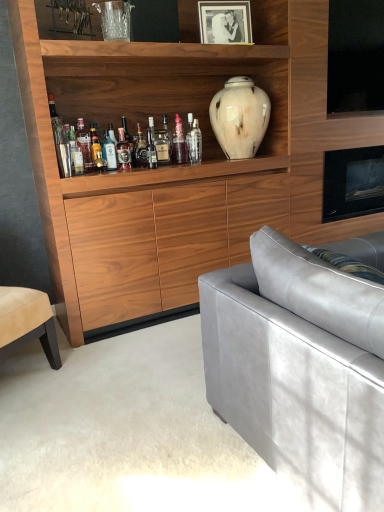
Question: From the image's perspective, does translucent glass bottle at center, placed as the 3th bottle when sorted from right to left, appear higher than clear glass bottle at center, which is the first bottle from right to left?

Choices:
 (A) yes
 (B) no

Answer: (B)

Question: Is translucent glass bottle at center, placed as the 7th bottle when sorted from left to right, further to the viewer compared to clear glass bottle at center, placed as the 9th bottle when sorted from left to right?

Choices:
 (A) no
 (B) yes

Answer: (B)

Question: From a real-world perspective, does translucent glass bottle at center, placed as the 7th bottle when sorted from left to right, stand above clear glass bottle at center, which is the first bottle from right to left?

Choices:
 (A) yes
 (B) no

Answer: (B)

Question: Considering the relative sizes of translucent glass bottle at center, placed as the 3th bottle when sorted from right to left, and clear glass bottle at center, placed as the 9th bottle when sorted from left to right, in the image provided, is translucent glass bottle at center, placed as the 3th bottle when sorted from right to left, bigger than clear glass bottle at center, placed as the 9th bottle when sorted from left to right,?

Choices:
 (A) no
 (B) yes

Answer: (B)

Question: Does translucent glass bottle at center, placed as the 3th bottle when sorted from right to left, turn towards clear glass bottle at center, placed as the 9th bottle when sorted from left to right?

Choices:
 (A) yes
 (B) no

Answer: (B)

Question: Is translucent glass bottle at center, placed as the 7th bottle when sorted from left to right, outside clear glass bottle at center, which is the first bottle from right to left?

Choices:
 (A) no
 (B) yes

Answer: (B)

Question: From a real-world perspective, is white marble vase at upper center physically below suede gray couch at right?

Choices:
 (A) no
 (B) yes

Answer: (A)

Question: Would you consider white marble vase at upper center to be distant from suede gray couch at right?

Choices:
 (A) no
 (B) yes

Answer: (B)

Question: Considering the relative positions of white marble vase at upper center and suede gray couch at right in the image provided, is white marble vase at upper center behind suede gray couch at right?

Choices:
 (A) no
 (B) yes

Answer: (B)

Question: Is white marble vase at upper center in contact with suede gray couch at right?

Choices:
 (A) yes
 (B) no

Answer: (B)

Question: Could suede gray couch at right be considered to be inside white marble vase at upper center?

Choices:
 (A) no
 (B) yes

Answer: (A)

Question: Is white marble vase at upper center bigger than suede gray couch at right?

Choices:
 (A) yes
 (B) no

Answer: (B)

Question: Is black matte photo frame at upper center far away from translucent glass bottle at center, placed as the 3th bottle when sorted from right to left?

Choices:
 (A) yes
 (B) no

Answer: (B)